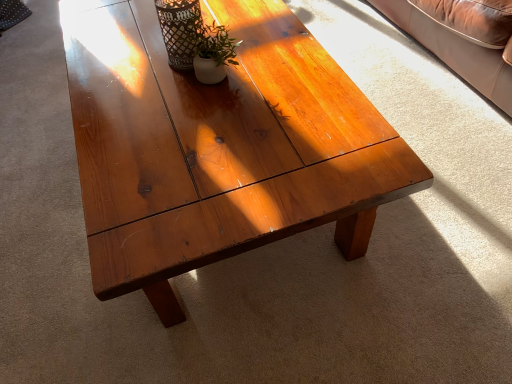
Question: From a real-world perspective, is matte black vase at upper center positioned under matte white vase at center based on gravity?

Choices:
 (A) yes
 (B) no

Answer: (B)

Question: Can you confirm if matte black vase at upper center is bigger than matte white vase at center?

Choices:
 (A) yes
 (B) no

Answer: (A)

Question: Considering the relative sizes of matte black vase at upper center and matte white vase at center in the image provided, is matte black vase at upper center thinner than matte white vase at center?

Choices:
 (A) no
 (B) yes

Answer: (A)

Question: From a real-world perspective, is matte black vase at upper center located higher than matte white vase at center?

Choices:
 (A) yes
 (B) no

Answer: (A)

Question: Is matte black vase at upper center oriented away from matte white vase at center?

Choices:
 (A) no
 (B) yes

Answer: (A)

Question: Considering their positions, is satin wood coffee table at center located in front of or behind matte white vase at center?

Choices:
 (A) behind
 (B) front

Answer: (B)

Question: Considering the positions of point (151, 188) and point (214, 21), is point (151, 188) closer or farther from the camera than point (214, 21)?

Choices:
 (A) closer
 (B) farther

Answer: (A)

Question: From the image's perspective, is satin wood coffee table at center above or below matte white vase at center?

Choices:
 (A) above
 (B) below

Answer: (A)

Question: Visually, is satin wood coffee table at center positioned to the left or to the right of matte white vase at center?

Choices:
 (A) right
 (B) left

Answer: (B)

Question: Considering the relative positions of matte white vase at center and matte black vase at upper center in the image provided, is matte white vase at center to the left or to the right of matte black vase at upper center?

Choices:
 (A) left
 (B) right

Answer: (B)

Question: Looking at their shapes, would you say matte white vase at center is wider or thinner than matte black vase at upper center?

Choices:
 (A) thin
 (B) wide

Answer: (A)

Question: Is point (239, 43) closer or farther from the camera than point (173, 59)?

Choices:
 (A) closer
 (B) farther

Answer: (B)

Question: Would you say matte white vase at center is inside or outside matte black vase at upper center?

Choices:
 (A) outside
 (B) inside

Answer: (A)

Question: From the image's perspective, is matte black vase at upper center positioned above or below matte white vase at center?

Choices:
 (A) below
 (B) above

Answer: (B)

Question: Considering their positions, is matte black vase at upper center located in front of or behind matte white vase at center?

Choices:
 (A) behind
 (B) front

Answer: (A)